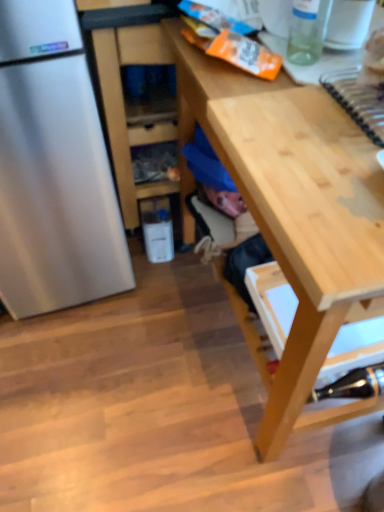
Locate an element on the screen. free point to the left of transparent glass bottle at upper right, placed as the 2th bottle when sorted from back to front is located at coordinates (227, 76).